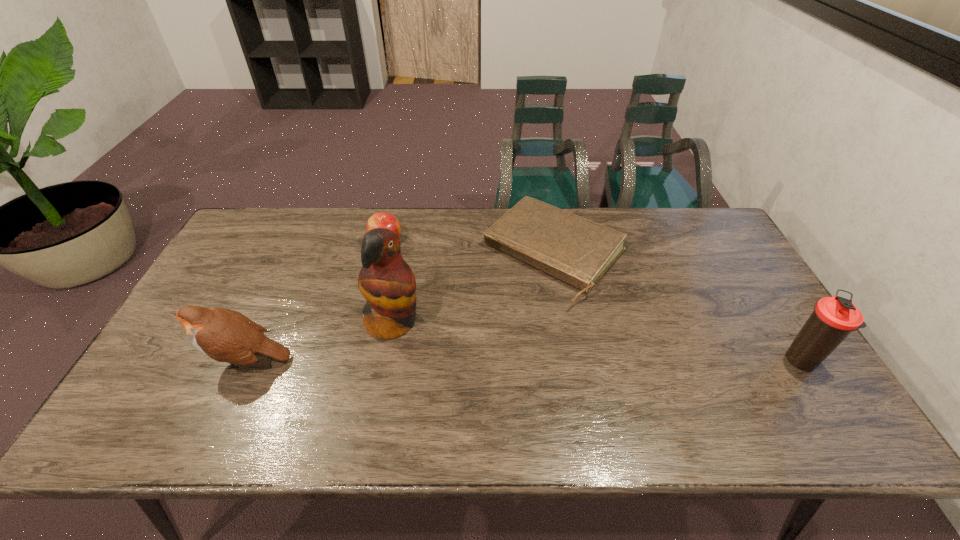
The image size is (960, 540). Find the location of `apple located at the far edge`. apple located at the far edge is located at coordinates (381, 219).

The width and height of the screenshot is (960, 540). In order to click on paperback book at the far edge in this screenshot , I will do [x=578, y=251].

Identify the location of bird at the near edge. The image size is (960, 540). (224, 335).

Identify the location of thermos bottle positioned at the near edge. (834, 318).

Identify the location of object situated at the left edge. (224, 335).

You are a GUI agent. You are given a task and a screenshot of the screen. Output one action in this format:
    pyautogui.click(x=<x>, y=<y>)
    Task: Click on the object that is at the right edge
    
    Given the screenshot: What is the action you would take?
    pyautogui.click(x=834, y=318)

Locate an element on the screen. object that is at the near left corner is located at coordinates (224, 335).

Where is `object located in the near right corner section of the desktop`? This screenshot has height=540, width=960. object located in the near right corner section of the desktop is located at coordinates (834, 318).

The height and width of the screenshot is (540, 960). In the image, there is a desktop. Identify the location of vacant area at the far edge. (655, 214).

This screenshot has width=960, height=540. Find the location of `vacant space at the near edge`. vacant space at the near edge is located at coordinates (507, 374).